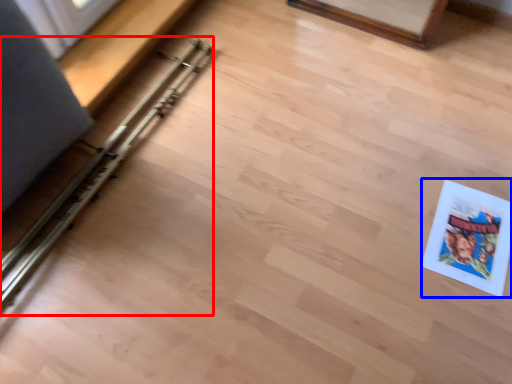
Question: Which object appears closest to the camera in this image, rail (highlighted by a red box) or comic book (highlighted by a blue box)?

Choices:
 (A) rail
 (B) comic book

Answer: (A)